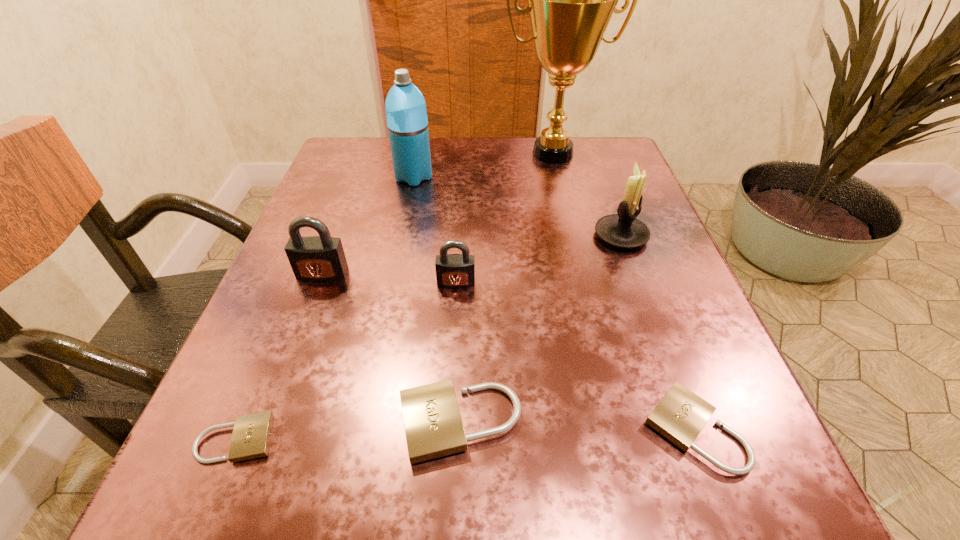
This screenshot has width=960, height=540. Identify the location of vacant area located on the front of the right gray padlock near the keyhole. (451, 364).

The width and height of the screenshot is (960, 540). I want to click on vacant space located on the right of the third shortest object, so click(x=732, y=422).

You are a GUI agent. You are given a task and a screenshot of the screen. Output one action in this format:
    pyautogui.click(x=<x>, y=<y>)
    Task: Click on the free region located 0.230m on the left of the rightmost padlock
    The image size is (960, 540).
    Given the screenshot: What is the action you would take?
    pyautogui.click(x=465, y=429)

What are the coordinates of `vacant area situated on the back of the leftmost beige padlock` in the screenshot? It's located at (305, 273).

Locate an element on the screen. award located in the far edge section of the desktop is located at coordinates (570, 0).

Find the location of a particular element. The image size is (960, 540). thermos bottle present at the far edge is located at coordinates tap(406, 114).

This screenshot has width=960, height=540. I want to click on thermos bottle present at the left edge, so click(x=406, y=114).

Where is `award located at the right edge`? The image size is (960, 540). award located at the right edge is located at coordinates (570, 0).

Identify the location of candle holder that is at the right edge. (624, 230).

You are a GUI agent. You are given a task and a screenshot of the screen. Output one action in this format:
    pyautogui.click(x=<x>, y=<y>)
    Task: Click on the padlock located at the right edge
    
    Given the screenshot: What is the action you would take?
    pyautogui.click(x=680, y=415)